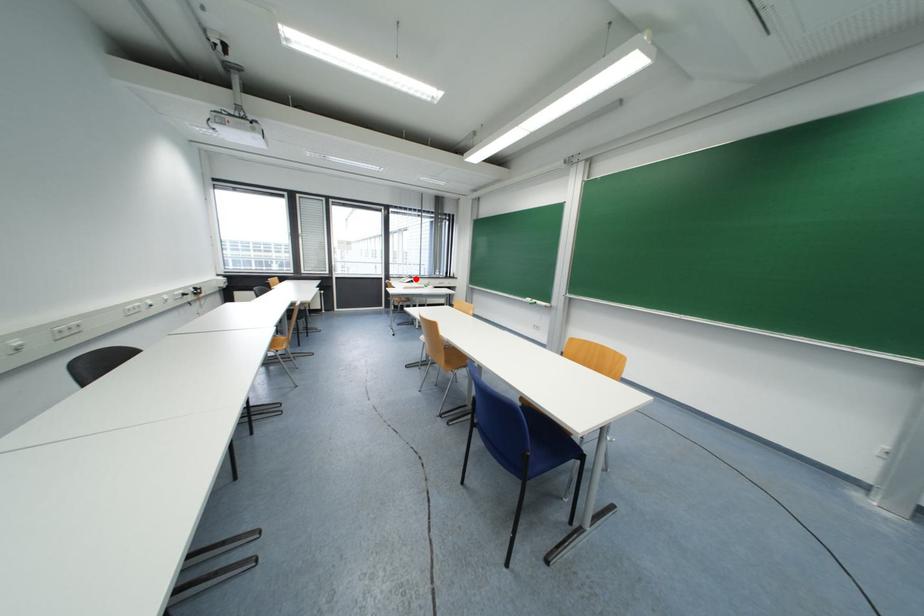
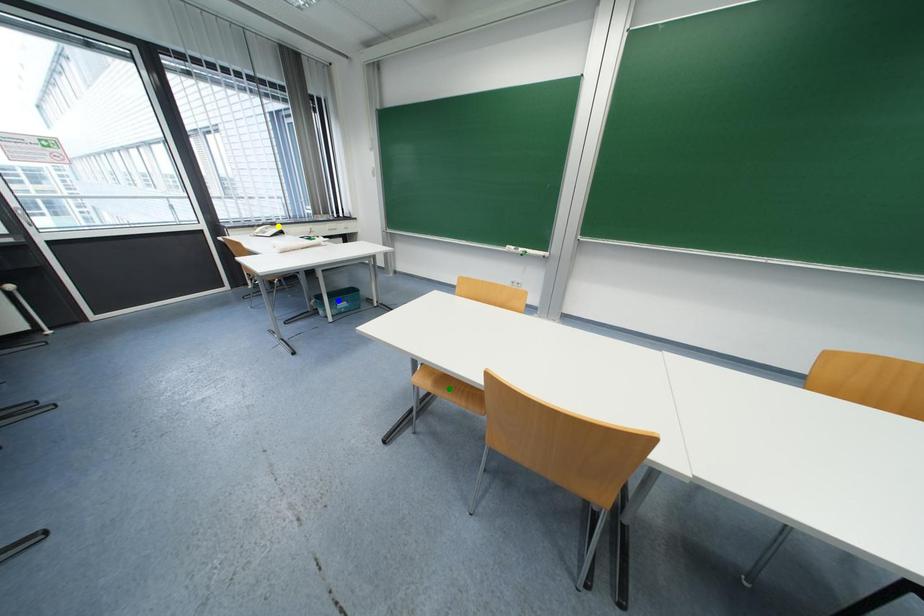
Question: I am providing you with two images of the same scene from different viewpoints. A red point is marked on the first image. You are given multiple points on the second image. Which point in image 2 is actually the same real-world point as the red point in image 1?

Choices:
 (A) green point
 (B) yellow point
 (C) blue point

Answer: (B)